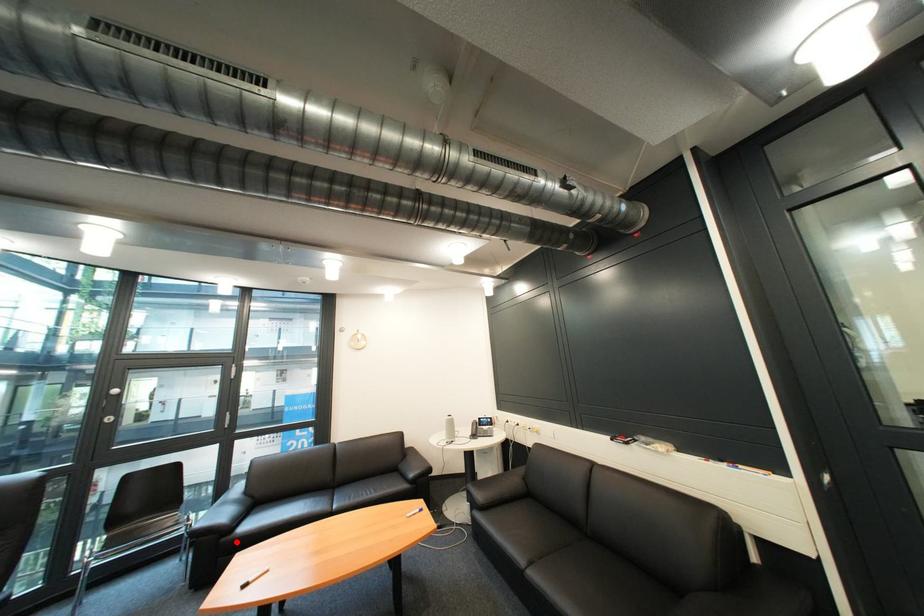
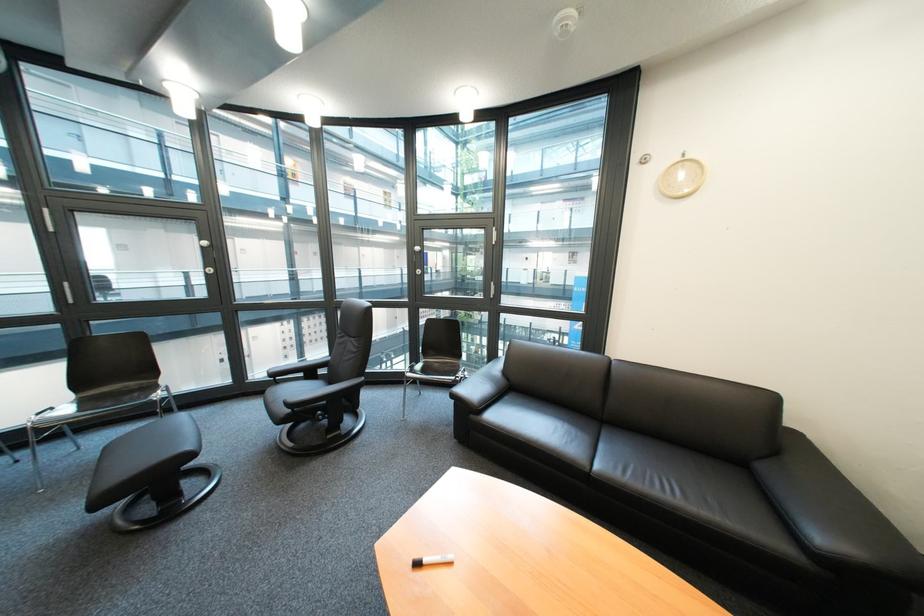
Question: I am providing you with two images of the same scene from different viewpoints. Given a red point in image1, look at the same physical point in image2. Is it:

Choices:
 (A) Closer to the viewpoint
 (B) Farther from the viewpoint

Answer: (B)